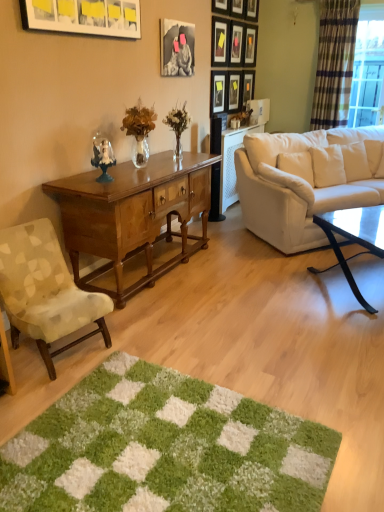
Locate an element on the screen. This screenshot has width=384, height=512. blank space situated above green shaggy rug at lower center (from a real-world perspective) is located at coordinates (153, 446).